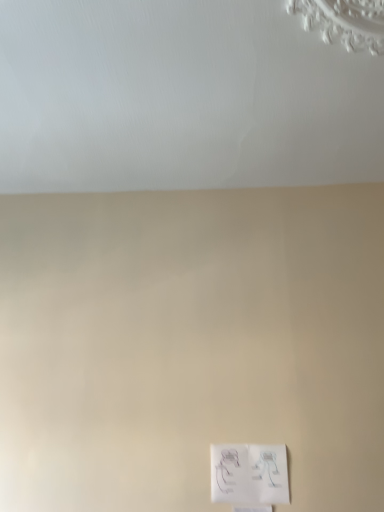
What do you see at coordinates (180, 98) in the screenshot? The image size is (384, 512). I see `white matte ceiling at upper center` at bounding box center [180, 98].

Measure the distance between white matte ceiling at upper center and camera.

3.96 feet.

Locate an element on the screen. white matte ceiling at upper center is located at coordinates (180, 98).

The height and width of the screenshot is (512, 384). In order to click on white paper at lower center in this screenshot , I will do `click(249, 474)`.

Measure the distance between point (x=241, y=452) and camera.

Point (x=241, y=452) and camera are 1.71 meters apart from each other.

What do you see at coordinates (249, 474) in the screenshot?
I see `white paper at lower center` at bounding box center [249, 474].

You are a GUI agent. You are given a task and a screenshot of the screen. Output one action in this format:
    pyautogui.click(x=<x>, y=<y>)
    Task: Click on the white matte ceiling at upper center
    The height and width of the screenshot is (512, 384).
    Given the screenshot: What is the action you would take?
    pyautogui.click(x=180, y=98)

Between white paper at lower center and white matte ceiling at upper center, which one appears on the right side from the viewer's perspective?

Positioned to the right is white paper at lower center.

Is white paper at lower center further to camera compared to white matte ceiling at upper center?

Yes, white paper at lower center is further from the viewer.

Does point (273, 462) lie behind point (190, 100)?

Yes, point (273, 462) is farther from viewer.

From the image's perspective, would you say white paper at lower center is positioned over white matte ceiling at upper center?

No, from the image's perspective, white paper at lower center is not over white matte ceiling at upper center.

From a real-world perspective, who is located lower, white paper at lower center or white matte ceiling at upper center?

white paper at lower center is physically lower.

Which of these two, white paper at lower center or white matte ceiling at upper center, is wider?

white matte ceiling at upper center is wider.

In terms of height, does white paper at lower center look taller or shorter compared to white matte ceiling at upper center?

Considering their sizes, white paper at lower center has more height than white matte ceiling at upper center.

Based on their sizes in the image, would you say white paper at lower center is bigger or smaller than white matte ceiling at upper center?

Clearly, white paper at lower center is smaller in size than white matte ceiling at upper center.

Can we say white paper at lower center lies outside white matte ceiling at upper center?

Absolutely, white paper at lower center is external to white matte ceiling at upper center.

Is there a large distance between white paper at lower center and white matte ceiling at upper center?

white paper at lower center is far away from white matte ceiling at upper center.

Could you tell me if white paper at lower center is facing white matte ceiling at upper center?

No, white paper at lower center is not turned towards white matte ceiling at upper center.

How different are the orientations of white paper at lower center and white matte ceiling at upper center in degrees?

There is a 90.6-degree angle between the facing directions of white paper at lower center and white matte ceiling at upper center.

You are a GUI agent. You are given a task and a screenshot of the screen. Output one action in this format:
    pyautogui.click(x=<x>, y=<y>)
    Task: Click on the light switch that appears on the right of white matte ceiling at upper center
    The image size is (384, 512).
    Given the screenshot: What is the action you would take?
    pyautogui.click(x=249, y=474)

Which object is positioned more to the right, white matte ceiling at upper center or white paper at lower center?

From the viewer's perspective, white paper at lower center appears more on the right side.

Based on the photo, is white matte ceiling at upper center behind white paper at lower center?

No, the depth of white matte ceiling at upper center is less than that of white paper at lower center.

Is point (174, 65) positioned in front of point (246, 450)?

That is True.

From the image's perspective, is white matte ceiling at upper center above or below white paper at lower center?

white matte ceiling at upper center is above white paper at lower center.

From a real-world perspective, does white matte ceiling at upper center sit lower than white paper at lower center?

No, from a real-world perspective, white matte ceiling at upper center is not below white paper at lower center.

Can you confirm if white matte ceiling at upper center is thinner than white paper at lower center?

No.

From their relative heights in the image, would you say white matte ceiling at upper center is taller or shorter than white paper at lower center?

Considering their sizes, white matte ceiling at upper center has less height than white paper at lower center.

In terms of size, does white matte ceiling at upper center appear bigger or smaller than white paper at lower center?

Clearly, white matte ceiling at upper center is larger in size than white paper at lower center.

Is white paper at lower center a part of white matte ceiling at upper center?

No, white paper at lower center is not surrounded by white matte ceiling at upper center.

Is white matte ceiling at upper center positioned far away from white paper at lower center?

Yes.

Is white matte ceiling at upper center aimed at white paper at lower center?

No, white matte ceiling at upper center does not turn towards white paper at lower center.

At what (x,y) coordinates should I click in order to perform the action: click on backdrop located above the white paper at lower center (from a real-world perspective). Please return your answer as a coordinate pair (x, y). Looking at the image, I should click on (180, 98).

This screenshot has height=512, width=384. What are the coordinates of `light switch behind the white matte ceiling at upper center` in the screenshot? It's located at (249, 474).

The height and width of the screenshot is (512, 384). What are the coordinates of `backdrop that appears above the white paper at lower center (from a real-world perspective)` in the screenshot? It's located at (180, 98).